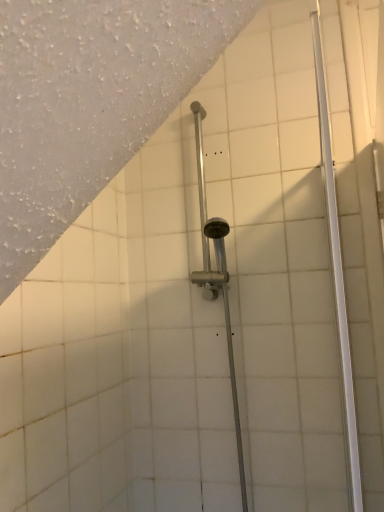
Question: Should I look upward or downward to see white glossy shower at right?

Choices:
 (A) up
 (B) down

Answer: (B)